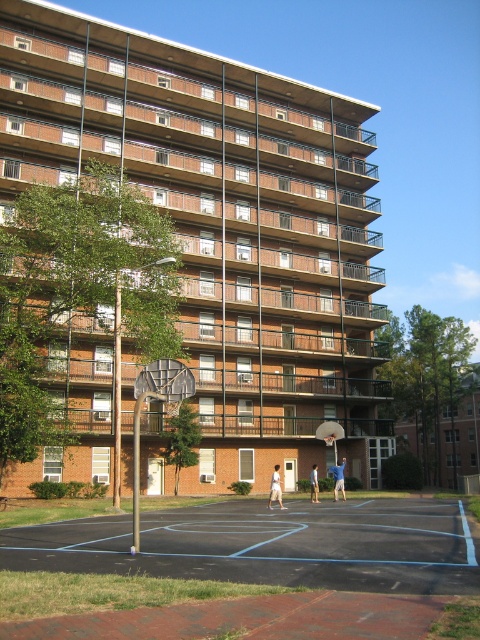
Question: Based on their relative distances, which object is nearer to the black asphalt basketball court at center?

Choices:
 (A) light beige shorts at center
 (B) blue cotton shirt at center
 (C) light brown shorts at center

Answer: (A)

Question: Does light beige shorts at center lie in front of light brown shorts at center?

Choices:
 (A) no
 (B) yes

Answer: (B)

Question: Is black asphalt basketball court at center to the left of light brown shorts at center from the viewer's perspective?

Choices:
 (A) yes
 (B) no

Answer: (A)

Question: Estimate the real-world distances between objects in this image. Which object is closer to the blue cotton shirt at center?

Choices:
 (A) light beige shorts at center
 (B) black asphalt basketball court at center
 (C) light brown shorts at center

Answer: (C)

Question: Which object is positioned closest to the light beige shorts at center?

Choices:
 (A) light brown shorts at center
 (B) blue cotton shirt at center
 (C) black asphalt basketball court at center

Answer: (A)

Question: Does black asphalt basketball court at center have a smaller size compared to light brown shorts at center?

Choices:
 (A) no
 (B) yes

Answer: (A)